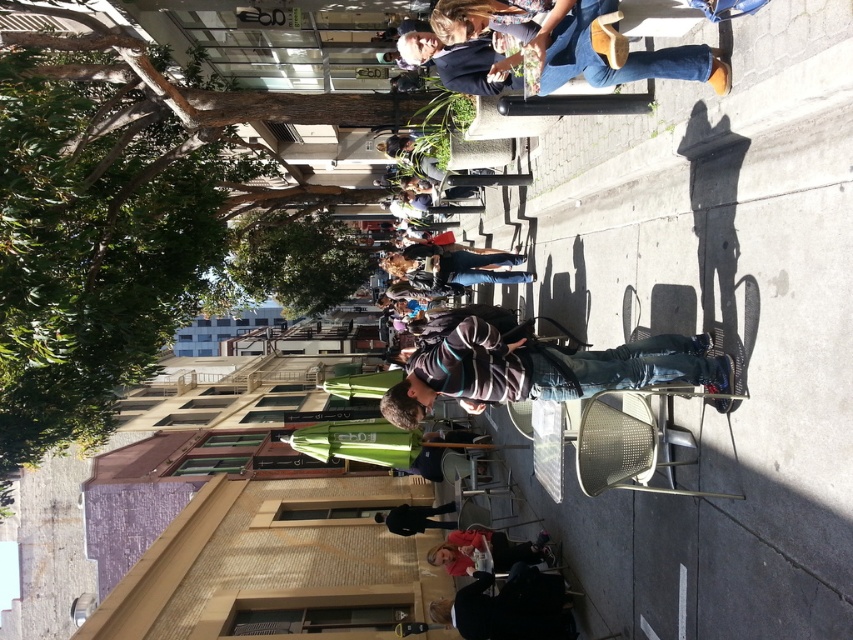
You are standing at point (x=415, y=508) and want to walk to the sidewalk entrance located at point (x=457, y=621). Is the entrance directly in front of you?

Yes, the entrance at point (x=457, y=621) is directly in front of you because it is positioned in front of your current location at point (x=415, y=508) according to the spatial description.